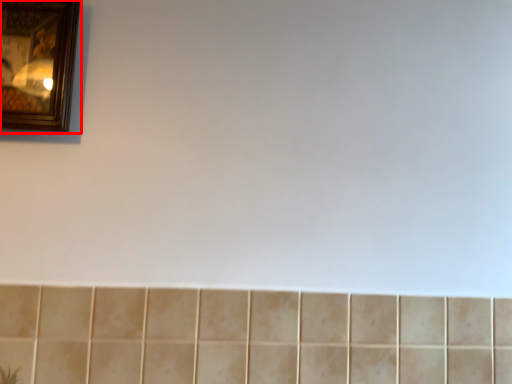
Question: From the image's perspective, where is picture frame (annotated by the red box) located relative to ceramic tile?

Choices:
 (A) below
 (B) above

Answer: (B)